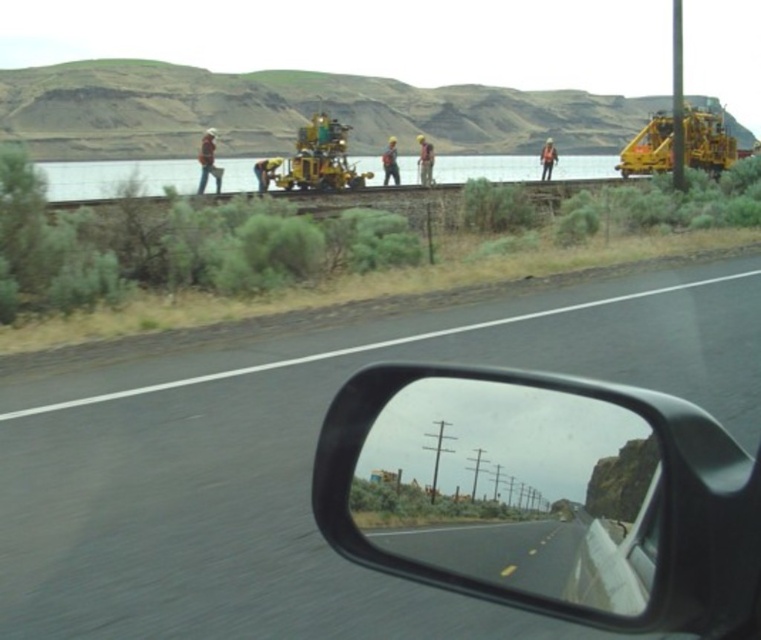
Who is lower down, smooth reflective mirror at center or yellow-green metallic excavator at center?

smooth reflective mirror at center is lower down.

Is point (597, 506) positioned behind point (310, 131)?

No, it is not.

Describe the element at coordinates (514, 490) in the screenshot. Image resolution: width=761 pixels, height=640 pixels. I see `smooth reflective mirror at center` at that location.

The height and width of the screenshot is (640, 761). I want to click on smooth reflective mirror at center, so click(x=514, y=490).

Does black asphalt road at center have a lesser width compared to smooth reflective mirror at center?

Incorrect, black asphalt road at center's width is not less than smooth reflective mirror at center's.

Between point (505, 360) and point (492, 442), which one is positioned in front?

Positioned in front is point (492, 442).

Between point (132, 560) and point (451, 424), which one is positioned behind?

Point (132, 560)

This screenshot has height=640, width=761. I want to click on black asphalt road at center, so click(306, 461).

Who is taller, black asphalt road at center or yellow-green metallic excavator at center?

With more height is yellow-green metallic excavator at center.

Does black asphalt road at center appear on the right side of yellow-green metallic excavator at center?

Yes, black asphalt road at center is to the right of yellow-green metallic excavator at center.

Is point (129, 371) behind point (310, 157)?

No.

I want to click on black asphalt road at center, so click(x=306, y=461).